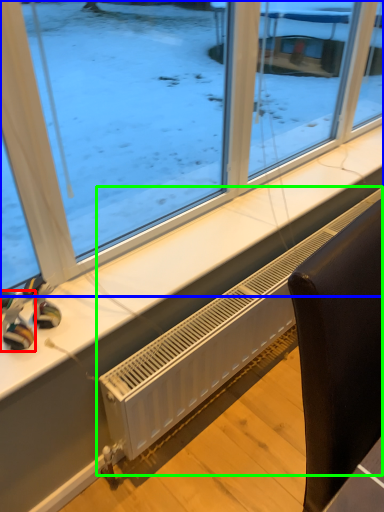
Question: Based on their relative distances, which object is nearer to toy (highlighted by a red box)? Choose from window (highlighted by a blue box) and air conditioning (highlighted by a green box).

Choices:
 (A) window
 (B) air conditioning

Answer: (B)